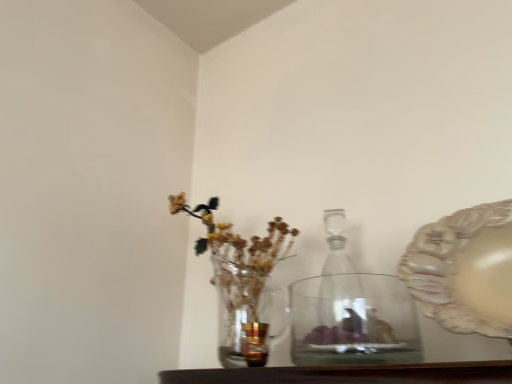
Question: From the image's perspective, is transparent glass vase at center located above or below transparent glass bottle at center?

Choices:
 (A) above
 (B) below

Answer: (B)

Question: Considering the positions of point (398, 306) and point (346, 292), is point (398, 306) closer or farther from the camera than point (346, 292)?

Choices:
 (A) farther
 (B) closer

Answer: (B)

Question: Estimate the real-world distances between objects in this image. Which object is farther from the transparent glass bottle at center?

Choices:
 (A) gold metallic candle holder at center
 (B) transparent glass vase at center
 (C) matte beige platter at right
 (D) clear glass vase at left

Answer: (A)

Question: Which of these objects is positioned farthest from the clear glass vase at left?

Choices:
 (A) matte beige platter at right
 (B) transparent glass bottle at center
 (C) transparent glass vase at center
 (D) gold metallic candle holder at center

Answer: (A)